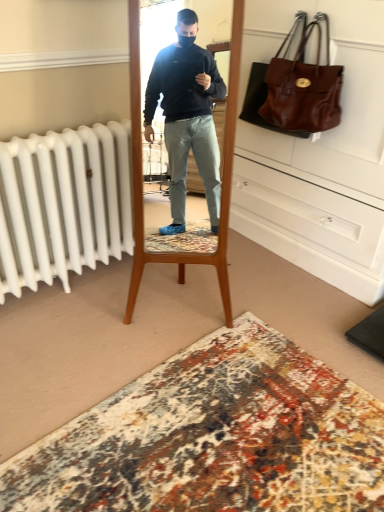
Question: Does brown leather handbag at upper right appear on the left side of matte brown leather dresser at upper right?

Choices:
 (A) no
 (B) yes

Answer: (B)

Question: Is matte brown leather dresser at upper right at the back of brown leather handbag at upper right?

Choices:
 (A) no
 (B) yes

Answer: (B)

Question: From the image's perspective, is brown leather handbag at upper right beneath matte brown leather dresser at upper right?

Choices:
 (A) yes
 (B) no

Answer: (B)

Question: Could you tell me if brown leather handbag at upper right is turned towards matte brown leather dresser at upper right?

Choices:
 (A) no
 (B) yes

Answer: (A)

Question: Could matte brown leather dresser at upper right be considered to be inside brown leather handbag at upper right?

Choices:
 (A) no
 (B) yes

Answer: (A)

Question: Considering the relative sizes of brown leather handbag at upper right and matte brown leather dresser at upper right in the image provided, is brown leather handbag at upper right smaller than matte brown leather dresser at upper right?

Choices:
 (A) no
 (B) yes

Answer: (B)

Question: Is brown leather handbag at upper right located within carpet with intricate patterns at lower center?

Choices:
 (A) no
 (B) yes

Answer: (A)

Question: From a real-world perspective, is carpet with intricate patterns at lower center located beneath brown leather handbag at upper right?

Choices:
 (A) yes
 (B) no

Answer: (A)

Question: Is carpet with intricate patterns at lower center far away from brown leather handbag at upper right?

Choices:
 (A) no
 (B) yes

Answer: (B)

Question: Is carpet with intricate patterns at lower center facing away from brown leather handbag at upper right?

Choices:
 (A) no
 (B) yes

Answer: (A)

Question: Is carpet with intricate patterns at lower center aimed at brown leather handbag at upper right?

Choices:
 (A) no
 (B) yes

Answer: (A)

Question: Is carpet with intricate patterns at lower center at the right side of brown leather handbag at upper right?

Choices:
 (A) yes
 (B) no

Answer: (B)

Question: Is brown leather handbag at upper right surrounded by matte brown leather dresser at upper right?

Choices:
 (A) no
 (B) yes

Answer: (B)